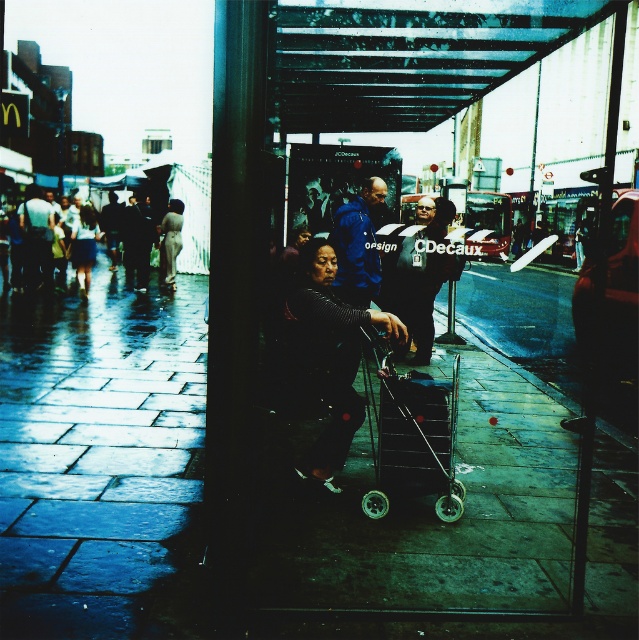
Is point (364, 376) closer to camera compared to point (335, 449)?

No, (364, 376) is behind (335, 449).

Which is more to the right, metallic silver trolley at center or dark gray fabric jacket at center?

Positioned to the right is metallic silver trolley at center.

Who is more distant from viewer, (419, 396) or (344, 330)?

Positioned behind is point (419, 396).

Identify the location of metallic silver trolley at center. (412, 436).

Does metallic silver cart at center appear over metallic silver trolley at center?

Yes.

What do you see at coordinates (314, 132) in the screenshot? Image resolution: width=639 pixels, height=640 pixels. I see `metallic silver cart at center` at bounding box center [314, 132].

Identify the location of metallic silver cart at center. (314, 132).

You are a GUI agent. You are given a task and a screenshot of the screen. Output one action in this format:
    pyautogui.click(x=<x>, y=<y>)
    Task: Click on the metallic silver cart at center
    The height and width of the screenshot is (640, 639).
    Given the screenshot: What is the action you would take?
    pyautogui.click(x=314, y=132)

You are a GUI agent. You are given a task and a screenshot of the screen. Output one action in this format:
    pyautogui.click(x=<x>, y=<y>)
    Task: Click on the dark gray fabric jacket at center
    This screenshot has height=640, width=639.
    Given the screenshot: What is the action you would take?
    pyautogui.click(x=334, y=352)

Does dark gray fabric jacket at center have a lesser height compared to blue fabric jacket at center?

Incorrect, dark gray fabric jacket at center's height does not fall short of blue fabric jacket at center's.

Is point (304, 253) closer to camera compared to point (366, 205)?

Yes.

You are a GUI agent. You are given a task and a screenshot of the screen. Output one action in this format:
    pyautogui.click(x=<x>, y=<y>)
    Task: Click on the dark gray fabric jacket at center
    
    Given the screenshot: What is the action you would take?
    pyautogui.click(x=334, y=352)